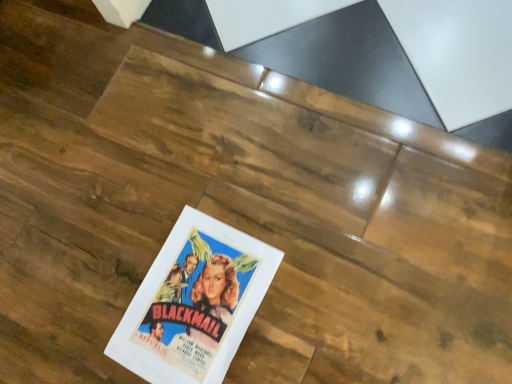
Locate an element on the screen. The image size is (512, 384). vacant space to the right of matte paper poster at center is located at coordinates (313, 256).